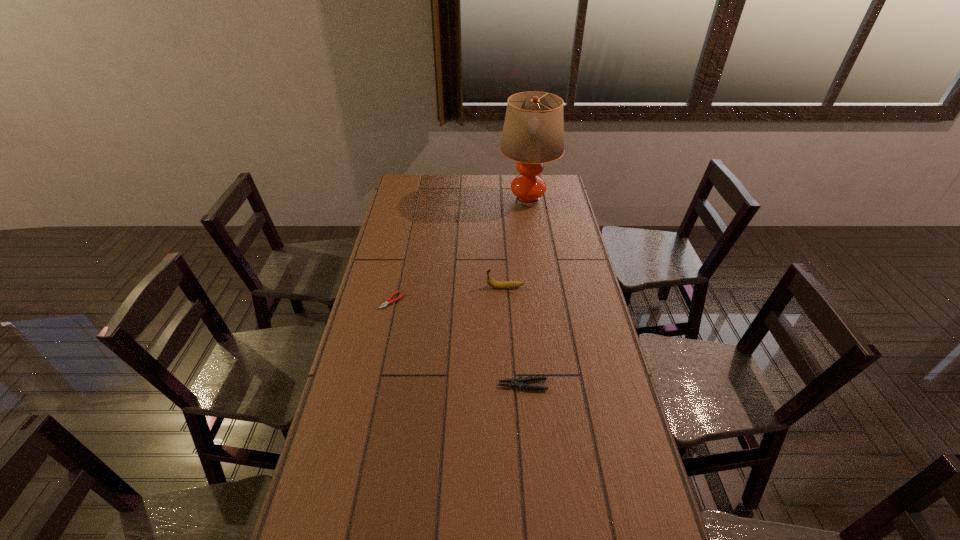
The height and width of the screenshot is (540, 960). In order to click on vacant position at the far edge of the desktop in this screenshot , I will do `click(509, 189)`.

The height and width of the screenshot is (540, 960). In the image, there is a desktop. Identify the location of free region at the left edge. (407, 241).

Find the location of a particular element. vacant space at the right edge of the desktop is located at coordinates (574, 284).

Where is `free region at the far left corner of the desktop`? This screenshot has width=960, height=540. free region at the far left corner of the desktop is located at coordinates (403, 189).

In the image, there is a desktop. In order to click on blank space at the far right corner in this screenshot , I will do `click(546, 180)`.

Where is `free space that is in between the nearest object and the lamp`? free space that is in between the nearest object and the lamp is located at coordinates (525, 293).

Locate an element on the screen. Image resolution: width=960 pixels, height=540 pixels. free space between the farther pliers and the nearer pliers is located at coordinates (458, 342).

Identify the location of vacant region between the nearer pliers and the farther pliers. 458,342.

Locate an element on the screen. The image size is (960, 540). empty space that is in between the shorter pliers and the third nearest object is located at coordinates (448, 294).

What are the coordinates of `unoccupied position between the nearest object and the third nearest object` in the screenshot? It's located at (514, 336).